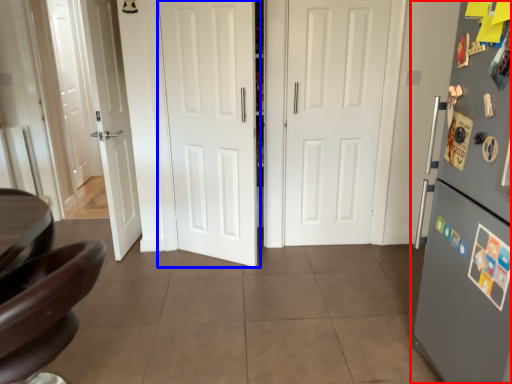
Question: Which point is closer to the camera, refrigerator (highlighted by a red box) or door (highlighted by a blue box)?

Choices:
 (A) refrigerator
 (B) door

Answer: (A)